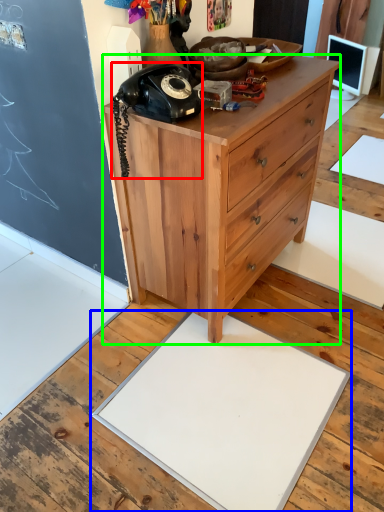
Question: Which is farther away from corded phone (highlighted by a red box)? slate (highlighted by a blue box) or chest of drawers (highlighted by a green box)?

Choices:
 (A) slate
 (B) chest of drawers

Answer: (A)